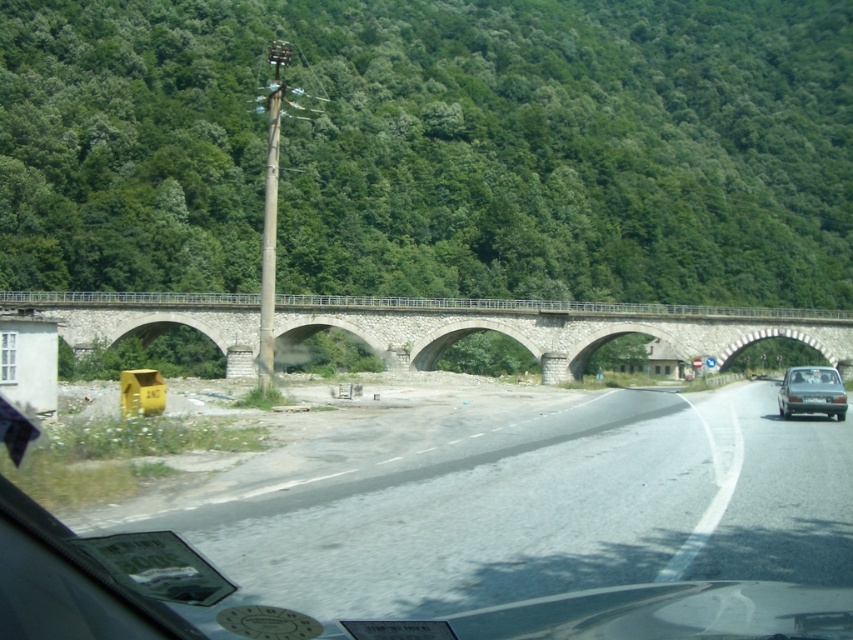
Question: Which point is farther from the camera taking this photo?

Choices:
 (A) (750, 336)
 (B) (718, 522)

Answer: (A)

Question: Observing the image, what is the correct spatial positioning of asphalt road at center in reference to silver metallic sedan at right?

Choices:
 (A) above
 (B) below

Answer: (A)

Question: Does stone arch bridge at center have a smaller size compared to silver metallic sedan at right?

Choices:
 (A) yes
 (B) no

Answer: (B)

Question: Observing the image, what is the correct spatial positioning of metallic pole at center-left in reference to silver metallic sedan at right?

Choices:
 (A) below
 (B) above

Answer: (B)

Question: Which object appears farthest from the camera in this image?

Choices:
 (A) silver metallic sedan at right
 (B) stone arch bridge at center
 (C) asphalt road at center

Answer: (B)

Question: Which of the following is the farthest from the observer?

Choices:
 (A) (274, 188)
 (B) (461, 492)

Answer: (A)